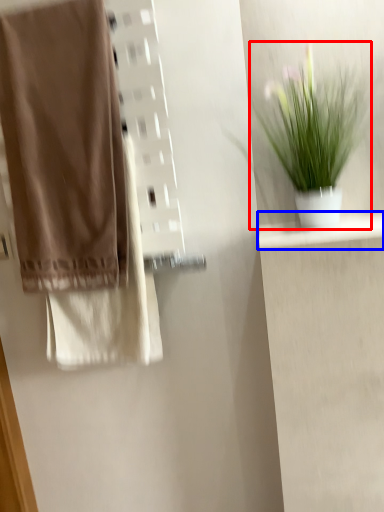
Question: Which object appears closest to the camera in this image, houseplant (highlighted by a red box) or shelf (highlighted by a blue box)?

Choices:
 (A) houseplant
 (B) shelf

Answer: (A)